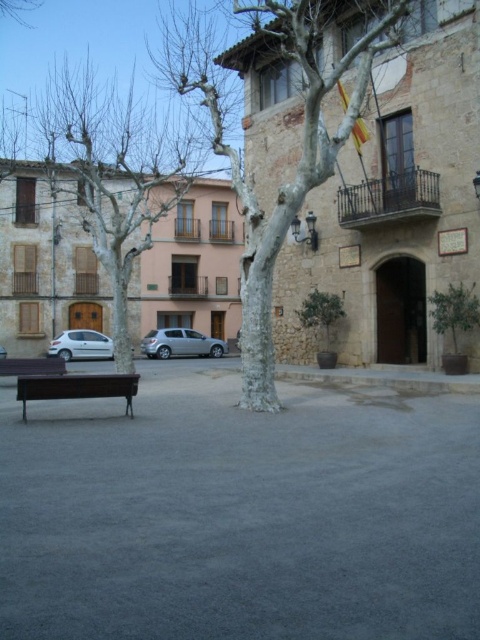
You are a tourist standing in the urban square. You see the bare wood tree at left and the dark brown wooden bench at lower left. Which object is positioned further to the left side of the square?

The bare wood tree at left is positioned further to the left side of the square compared to the dark brown wooden bench at lower left.

You are a city planner assessing the square. You need to place a new bench that is 1.5 meters wide. Given the space between the bare wood tree at left and the dark brown wooden bench at lower left, can the new bench fit there?

The bare wood tree at left might be wider than the dark brown wooden bench at lower left. Since the tree could be wider, it is uncertain if there is enough space to place the new bench. Further measurement is needed to confirm.